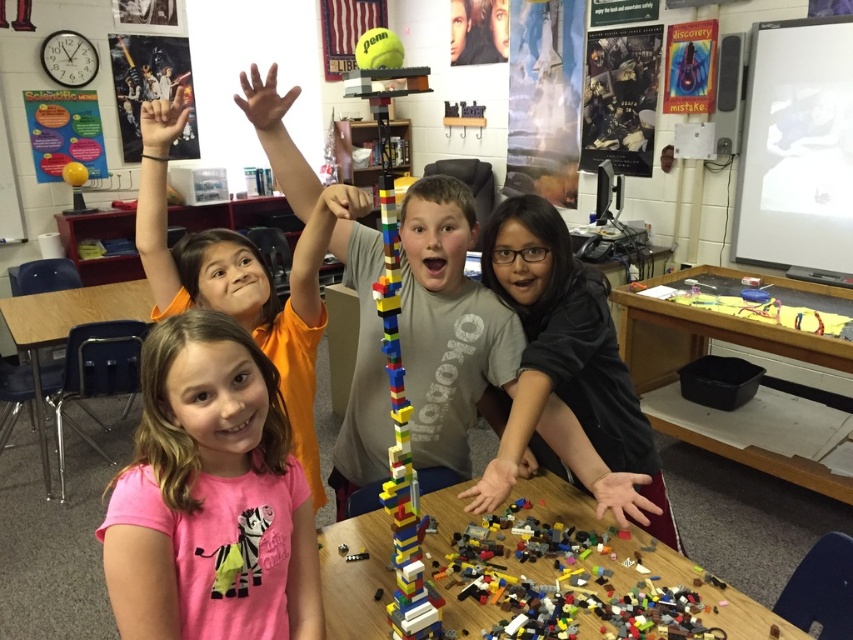
You are a teacher in the classroom. You want to move a new poster to the wall behind the multicolored plastic lego tower at center and the brown wooden table at left. Which object should you move to make space for the new poster?

The multicolored plastic lego tower at center has a larger width than the brown wooden table at left, so you should move the multicolored plastic lego tower at center to make space for the new poster.